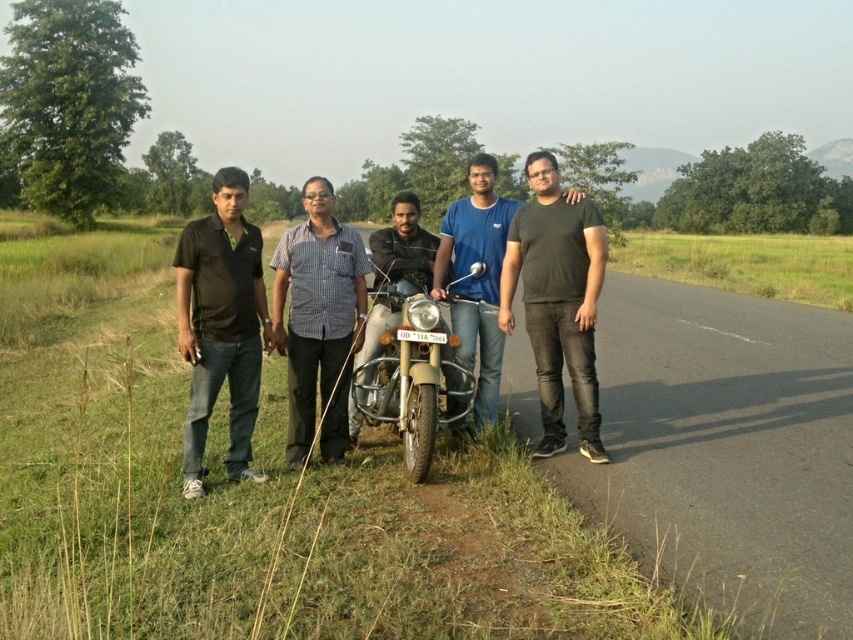
Question: Which point appears closest to the camera in this image?

Choices:
 (A) (346, 236)
 (B) (541, 333)
 (C) (439, 346)

Answer: (C)

Question: Is dark gray matte t-shirt at center closer to the viewer compared to checkered fabric shirt at center?

Choices:
 (A) no
 (B) yes

Answer: (A)

Question: Considering the relative positions of black matte shirt at left and dark gray t-shirt at center in the image provided, where is black matte shirt at left located with respect to dark gray t-shirt at center?

Choices:
 (A) below
 (B) above

Answer: (A)

Question: Does checkered fabric shirt at center appear under matte beige motorcycle at center?

Choices:
 (A) no
 (B) yes

Answer: (A)

Question: Which object is farther from the camera taking this photo?

Choices:
 (A) dark gray t-shirt at center
 (B) checkered fabric shirt at center
 (C) black matte shirt at left
 (D) dark gray matte t-shirt at center

Answer: (D)

Question: Which object is the closest to the dark gray matte t-shirt at center?

Choices:
 (A) matte beige motorcycle at center
 (B) black matte shirt at left
 (C) checkered fabric shirt at center

Answer: (A)